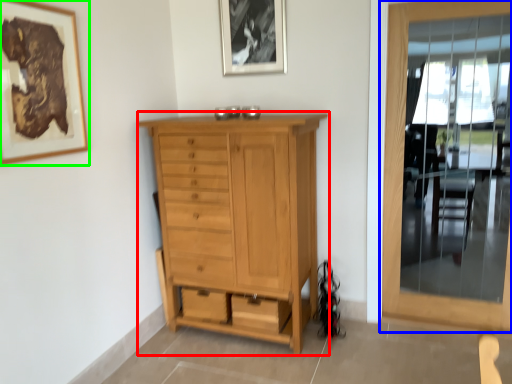
Question: Which object is positioned closest to chest of drawers (highlighted by a red box)? Select from door (highlighted by a blue box) and picture frame (highlighted by a green box).

Choices:
 (A) door
 (B) picture frame

Answer: (B)